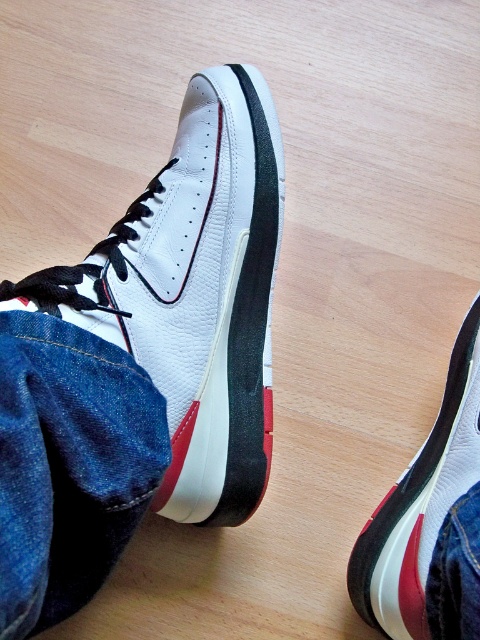
Where is `white matte/suede sneaker at lower center`? This screenshot has width=480, height=640. white matte/suede sneaker at lower center is located at coordinates (420, 502).

Is white matte/suede sneaker at lower center to the right of denim at lower right from the viewer's perspective?

Indeed, white matte/suede sneaker at lower center is positioned on the right side of denim at lower right.

Is point (435, 419) positioned behind point (467, 508)?

Yes.

The image size is (480, 640). I want to click on white matte/suede sneaker at lower center, so click(x=420, y=502).

Who is positioned more to the left, white leather sneaker at center or denim at lower right?

white leather sneaker at center

Can you confirm if white leather sneaker at center is taller than denim at lower right?

Correct, white leather sneaker at center is much taller as denim at lower right.

I want to click on white leather sneaker at center, so click(x=193, y=292).

Based on the photo, between white leather sneaker at center and white matte/suede sneaker at lower center, which one appears on the right side from the viewer's perspective?

white matte/suede sneaker at lower center is more to the right.

Does point (249, 109) come farther from viewer compared to point (450, 403)?

Yes, point (249, 109) is farther from viewer.

Find the location of `white leather sneaker at center`. white leather sneaker at center is located at coordinates (193, 292).